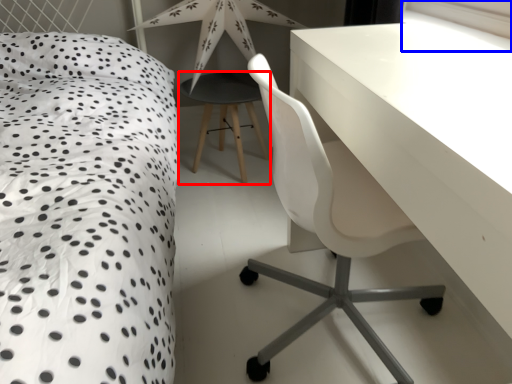
Question: Which object is further to the camera taking this photo, bar stool (highlighted by a red box) or window screen (highlighted by a blue box)?

Choices:
 (A) bar stool
 (B) window screen

Answer: (A)